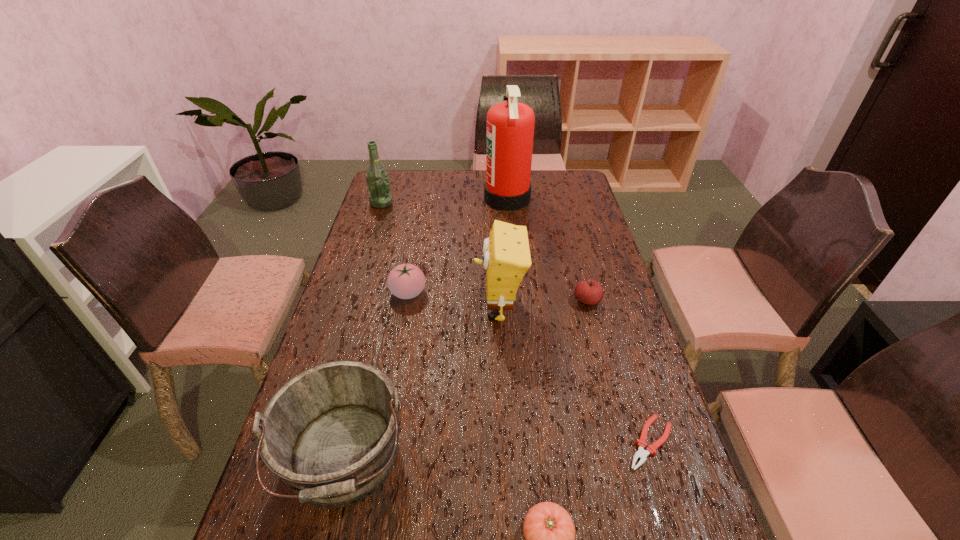
Identify which tomato is the nearest to the rightmost tomato. Please provide its 2D coordinates. Your answer should be formatted as a tuple, i.e. [(x, y)], where the tuple contains the x and y coordinates of a point satisfying the conditions above.

[(406, 281)]

I want to click on blank space that satisfies the following two spatial constraints: 1. on the surface of the fifth shortest object; 2. on the left side of the beer bottle, so click(x=300, y=460).

You are a GUI agent. You are given a task and a screenshot of the screen. Output one action in this format:
    pyautogui.click(x=<x>, y=<y>)
    Task: Click on the free space in the image that satisfies the following two spatial constraints: 1. on the face of the sponge; 2. on the back side of the shortest object
    
    Given the screenshot: What is the action you would take?
    pyautogui.click(x=505, y=443)

What are the coordinates of `vacant space that satisfies the following two spatial constraints: 1. at the nozzle of the rightmost tomato; 2. on the left side of the tallest object` in the screenshot? It's located at [516, 301].